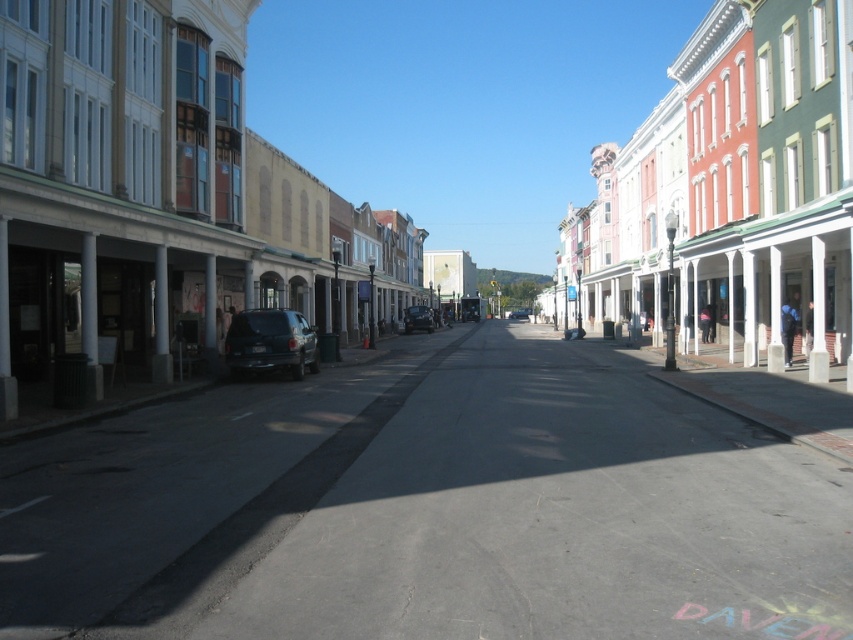
Question: Does matte black suv at center have a greater width compared to shiny black car at center?

Choices:
 (A) no
 (B) yes

Answer: (A)

Question: Does red brick building at center have a larger size compared to shiny black car at center?

Choices:
 (A) yes
 (B) no

Answer: (A)

Question: Which of the following is the farthest from the observer?

Choices:
 (A) shiny black car at center
 (B) matte black van at center
 (C) matte black suv at center
 (D) red brick building at center

Answer: (B)

Question: Can you confirm if matte black suv at center is positioned below matte black van at center?

Choices:
 (A) no
 (B) yes

Answer: (B)

Question: Which of the following is the closest to the observer?

Choices:
 (A) click(x=409, y=324)
 (B) click(x=283, y=339)
 (C) click(x=514, y=317)
 (D) click(x=813, y=218)

Answer: (D)

Question: Which point is farther to the camera?

Choices:
 (A) (741, 353)
 (B) (419, 317)
 (C) (527, 312)
 (D) (260, 337)

Answer: (C)